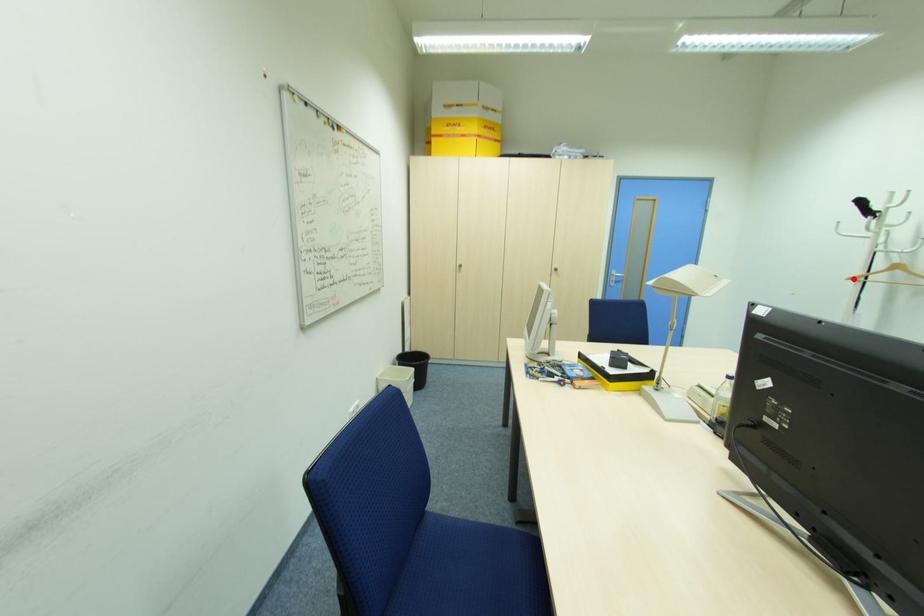
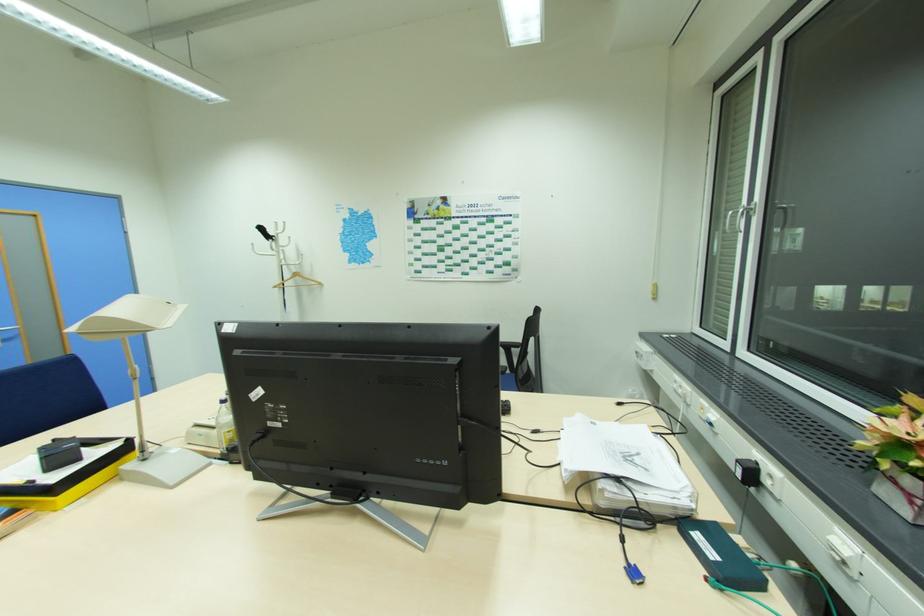
Question: I am providing you with two images of the same scene from different viewpoints. A red point is marked on the first image. At the location where the point appears in image 1, is it still visible in image 2?

Choices:
 (A) Yes
 (B) No

Answer: (A)